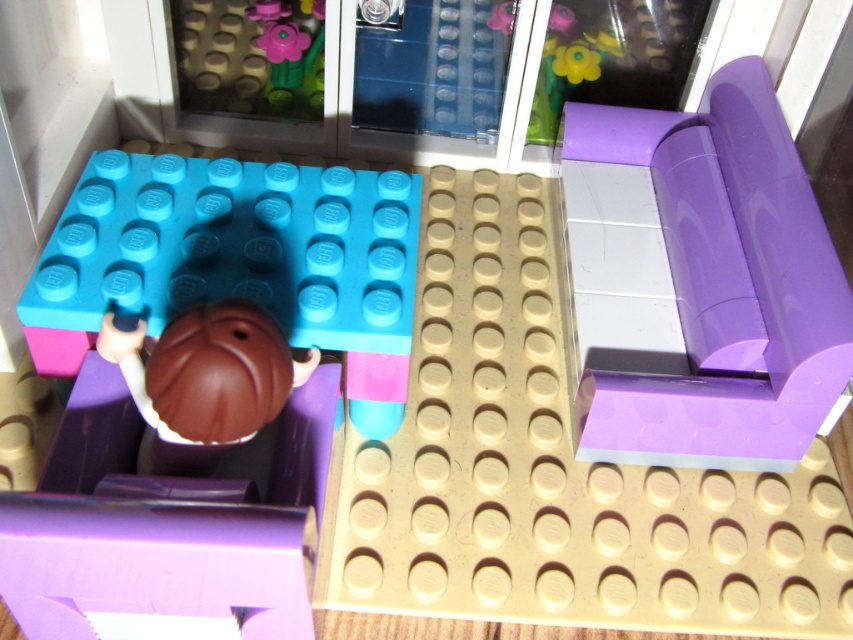
You are designing a living room layout using LEGO pieces. You have a purple glossy couch at upper right and a matte blue plate at center. Which object should you place first if you want to prioritize larger items in your design?

You should place the purple glossy couch at upper right first because it has a larger size compared to the matte blue plate at center, so prioritizing larger items would mean starting with the couch.

You are a LEGO builder and need to place a new brick between the two points, point (793, 445) and point (41, 288). Based on their positions, which point should the brick be closer to?

Point (793, 445) is behind point (41, 288), so the brick should be placed closer to point (41, 288) to maintain the layering.

You are a LEGO figure trying to move from the purple glossy couch at upper right to the matte blue plate at center. Which direction should you move to reach it?

The purple glossy couch at upper right is positioned on the right side of the matte blue plate at center, so the LEGO figure should move to the left to reach the matte blue plate at center.